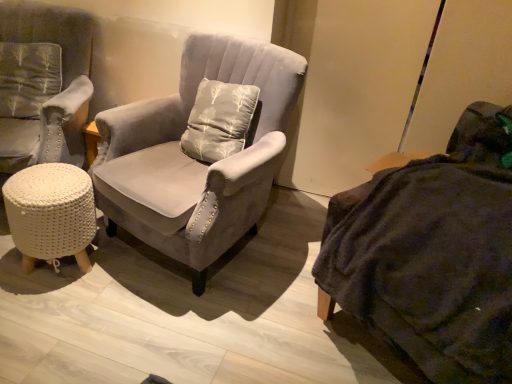
Image resolution: width=512 pixels, height=384 pixels. Find the location of `blank space situated above white knitted stool at lower left (from a real-world perspective)`. blank space situated above white knitted stool at lower left (from a real-world perspective) is located at coordinates (51, 175).